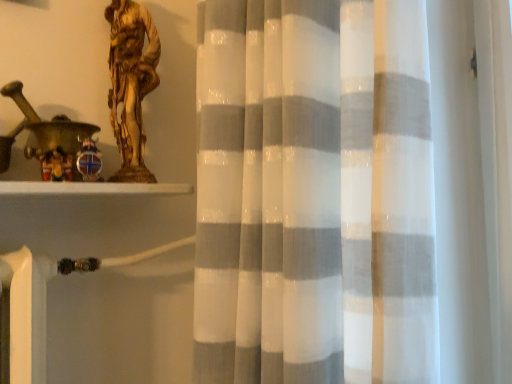
In order to click on gold metallic statue at upper left in this screenshot , I will do `click(131, 83)`.

What do you see at coordinates (131, 83) in the screenshot? I see `gold metallic statue at upper left` at bounding box center [131, 83].

Where is `wooden figurine at left`? This screenshot has height=384, width=512. wooden figurine at left is located at coordinates (52, 138).

Image resolution: width=512 pixels, height=384 pixels. Describe the element at coordinates (52, 138) in the screenshot. I see `wooden figurine at left` at that location.

Find the location of a particular element. gold metallic statue at upper left is located at coordinates (131, 83).

Which is more to the left, gold metallic statue at upper left or wooden figurine at left?

From the viewer's perspective, wooden figurine at left appears more on the left side.

Between gold metallic statue at upper left and wooden figurine at left, which one is positioned behind?

gold metallic statue at upper left is further from the camera.

Which is closer, (118, 16) or (73, 126)?

The point (73, 126) is in front.

From the image's perspective, who appears lower, gold metallic statue at upper left or wooden figurine at left?

wooden figurine at left.

From a real-world perspective, which object stands above the other?

gold metallic statue at upper left is physically above.

Between gold metallic statue at upper left and wooden figurine at left, which one has smaller width?

With smaller width is gold metallic statue at upper left.

Which of these two, gold metallic statue at upper left or wooden figurine at left, stands shorter?

wooden figurine at left is shorter.

Between gold metallic statue at upper left and wooden figurine at left, which one has smaller size?

With smaller size is wooden figurine at left.

Is wooden figurine at left completely or partially inside gold metallic statue at upper left?

No, gold metallic statue at upper left does not contain wooden figurine at left.

Would you say gold metallic statue at upper left is a long distance from wooden figurine at left?

That's not correct — gold metallic statue at upper left is a little close to wooden figurine at left.

Is gold metallic statue at upper left facing away from wooden figurine at left?

gold metallic statue at upper left does not have its back to wooden figurine at left.

Measure the distance between gold metallic statue at upper left and wooden figurine at left.

They are 6.17 inches apart.

The width and height of the screenshot is (512, 384). Identify the location of sculpture located above the wooden figurine at left (from the image's perspective). (131, 83).

Is wooden figurine at left at the right side of gold metallic statue at upper left?

No, wooden figurine at left is not to the right of gold metallic statue at upper left.

Is the position of wooden figurine at left more distant than that of gold metallic statue at upper left?

No, wooden figurine at left is closer to the camera.

Is point (32, 157) positioned behind point (143, 39)?

No.

From the image's perspective, is wooden figurine at left above or below gold metallic statue at upper left?

Clearly, from the image's perspective, wooden figurine at left is below gold metallic statue at upper left.

From a real-world perspective, is wooden figurine at left positioned above or below gold metallic statue at upper left?

In terms of real-world spatial position, wooden figurine at left is below gold metallic statue at upper left.

Can you confirm if wooden figurine at left is thinner than gold metallic statue at upper left?

In fact, wooden figurine at left might be wider than gold metallic statue at upper left.

From the picture: Between wooden figurine at left and gold metallic statue at upper left, which one has less height?

wooden figurine at left.

Looking at this image, considering the relative sizes of wooden figurine at left and gold metallic statue at upper left in the image provided, is wooden figurine at left smaller than gold metallic statue at upper left?

Correct, wooden figurine at left occupies less space than gold metallic statue at upper left.

Would you say gold metallic statue at upper left is part of wooden figurine at left's contents?

No, gold metallic statue at upper left is not inside wooden figurine at left.

Is wooden figurine at left with gold metallic statue at upper left?

No.

Is wooden figurine at left facing towards gold metallic statue at upper left?

No, wooden figurine at left is not turned towards gold metallic statue at upper left.

Locate an element on the screen. sculpture above the wooden figurine at left (from a real-world perspective) is located at coordinates (131, 83).

At what (x,y) coordinates should I click in order to perform the action: click on sculpture above the wooden figurine at left (from a real-world perspective). Please return your answer as a coordinate pair (x, y). This screenshot has width=512, height=384. Looking at the image, I should click on pyautogui.click(x=131, y=83).

The image size is (512, 384). What are the coordinates of `toy that appears on the left of gold metallic statue at upper left` in the screenshot? It's located at (52, 138).